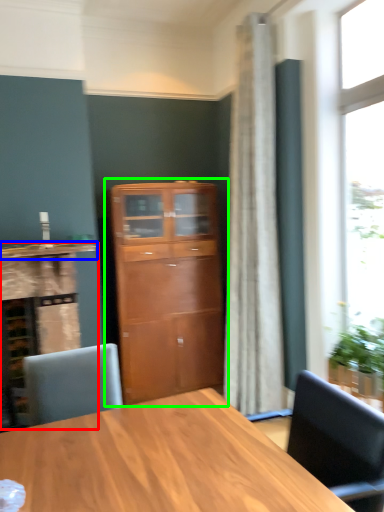
Question: Which object is the closest to the cabinetry (highlighted by a red box)? Choose among these: counter top (highlighted by a blue box) or cupboard (highlighted by a green box).

Choices:
 (A) counter top
 (B) cupboard

Answer: (A)